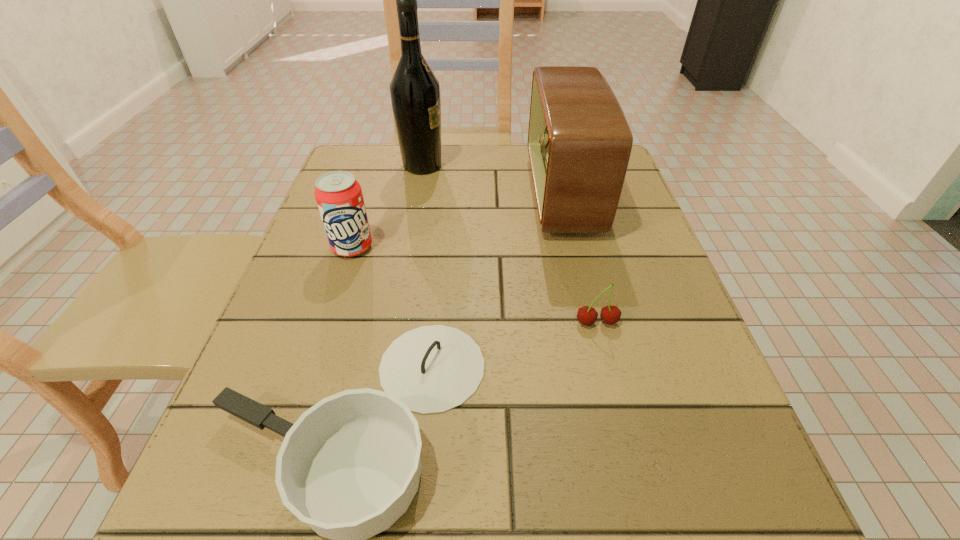
The width and height of the screenshot is (960, 540). What are the coordinates of `vacant space at the left edge of the desktop` in the screenshot? It's located at (281, 300).

Identify the location of vacant area at the right edge of the desktop. (636, 257).

At what (x,y) coordinates should I click in order to perform the action: click on free region at the far left corner of the desktop. Please return your answer as a coordinate pair (x, y). Looking at the image, I should click on (372, 173).

In the image, there is a desktop. Identify the location of free region at the near left corner. (276, 492).

Identify the location of free spot between the second shortest object and the third tallest object. The height and width of the screenshot is (540, 960). (474, 285).

At what (x,y) coordinates should I click in order to perform the action: click on empty space between the wine bottle and the fourth tallest object. Please return your answer as a coordinate pair (x, y). The width and height of the screenshot is (960, 540). Looking at the image, I should click on (510, 244).

Find the location of a particular element. The height and width of the screenshot is (540, 960). free space between the second shortest object and the soda can is located at coordinates (474, 285).

Find the location of a particular element. The height and width of the screenshot is (540, 960). vacant area between the third shortest object and the cherry is located at coordinates (474, 285).

I want to click on free spot between the radio receiver and the tallest object, so click(x=492, y=180).

Image resolution: width=960 pixels, height=540 pixels. I want to click on empty space that is in between the third shortest object and the wine bottle, so click(387, 206).